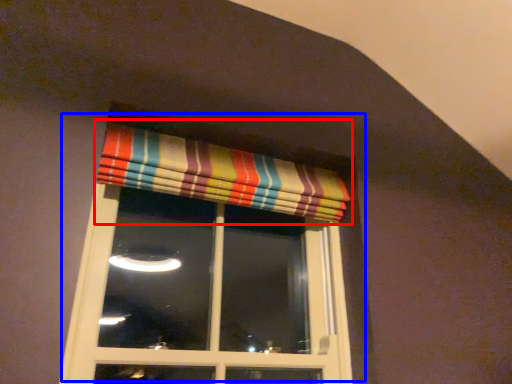
Question: Which of the following is the closest to the observer, curtain (highlighted by a red box) or window (highlighted by a blue box)?

Choices:
 (A) curtain
 (B) window

Answer: (B)